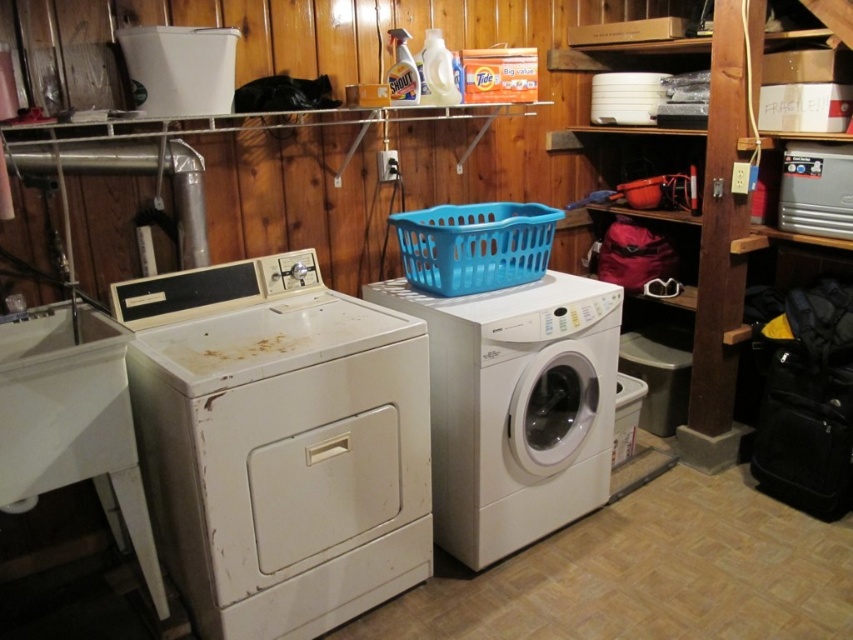
Consider the image. You are organizing the utility room and need to place a new item between the white glossy washing machine at center and the silver metallic refrigerator at upper right. Based on their positions, which appliance should the new item be closer to?

The new item should be placed closer to the silver metallic refrigerator at upper right because the white glossy washing machine at center is to the left of it, meaning the refrigerator is on the right side.

You are standing in the utility room and want to reach the point at coordinates (468, 422). Can you estimate how far you need to move to reach that point?

The point at coordinates (468, 422) is 2.15 meters away from you, so you need to move approximately 2.15 meters to reach it.

From the picture: You are standing in the utility room and want to reach a point that is 1.92 meters away from you. Is the point at point (202, 616) within reach of your outstretched arm, considering an average arm length of 0.7 meters?

The point at point (202, 616) is 1.92 meters away from you, which is farther than the average arm length of 0.7 meters. Therefore, you cannot reach it with your outstretched arm.